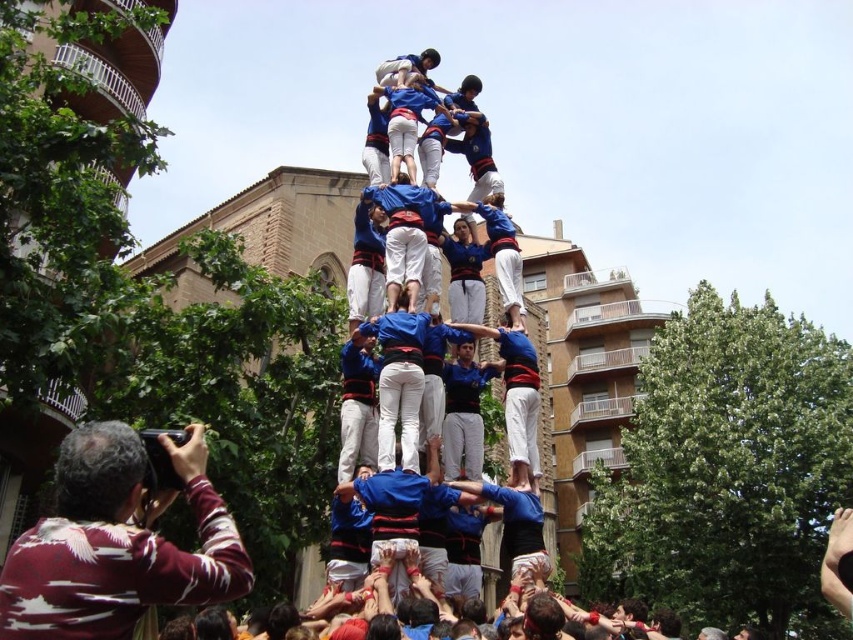
You are standing at the base of the human tower and want to take a photo of the highest point, which is marked as point (48, 573). If your camera has a maximum focus range of 20 meters, will it be able to capture the point clearly?

The distance of point (48, 573) from the viewer is 19.83 meters, which is within the camera maximum focus range of 20 meters. Therefore, the camera can capture the point clearly.

You are a photographer trying to capture the human tower. You notice the maroon striped shirt at lower left and the blue jersey at center. Which participant is shorter in height?

The maroon striped shirt at lower left is not as tall as the blue jersey at center, so the participant wearing the maroon striped shirt at lower left is shorter in height.